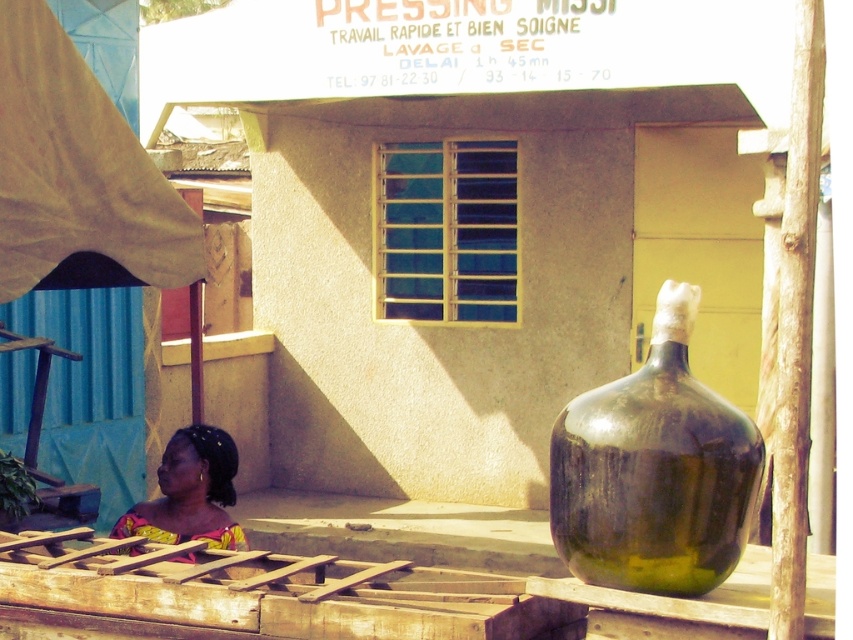
Question: Is green glass vase at center bigger than yellow printed fabric at lower left?

Choices:
 (A) no
 (B) yes

Answer: (A)

Question: Is green glass vase at center smaller than yellow printed fabric at lower left?

Choices:
 (A) no
 (B) yes

Answer: (B)

Question: Is green glass vase at center above yellow printed fabric at lower left?

Choices:
 (A) yes
 (B) no

Answer: (A)

Question: Among these objects, which one is nearest to the camera?

Choices:
 (A) green glass vase at center
 (B) yellow printed fabric at lower left

Answer: (A)